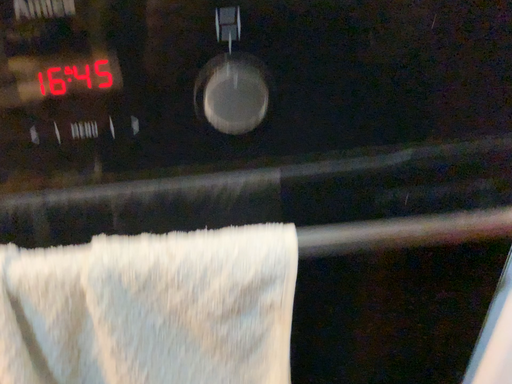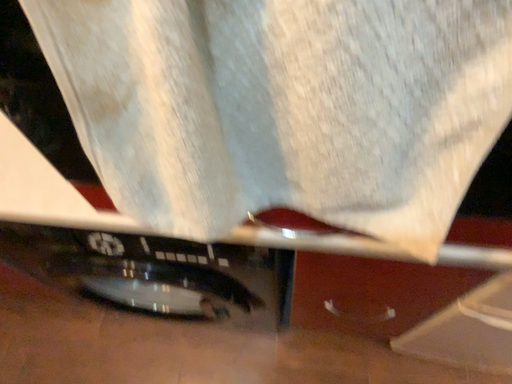
Question: How did the camera likely rotate when shooting the video?

Choices:
 (A) rotated right
 (B) rotated left

Answer: (B)